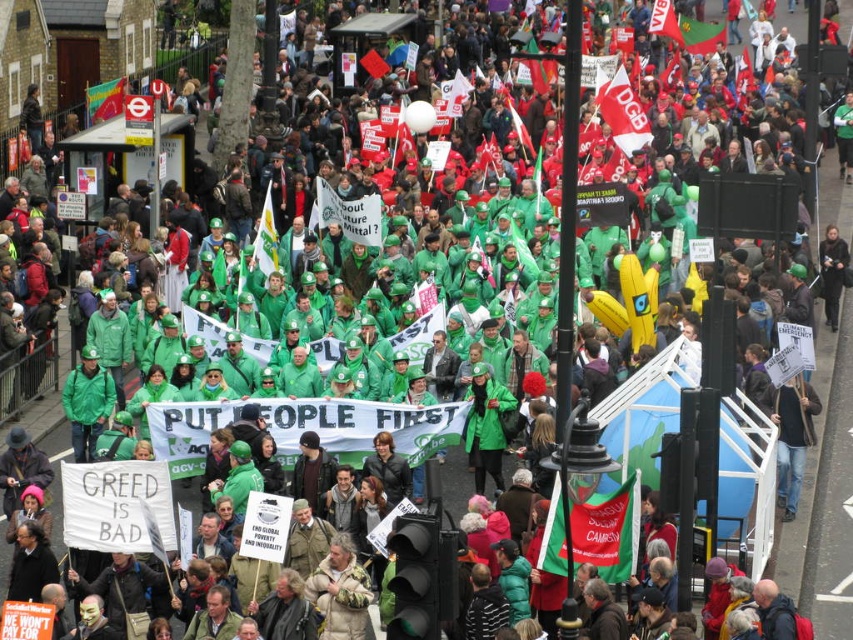
Question: Which of these objects is positioned closest to the green fabric flag at center?

Choices:
 (A) green fabric flag at upper center
 (B) red fabric flag at upper center

Answer: (B)

Question: Is red fabric flag at upper center positioned in front of green fabric flag at upper center?

Choices:
 (A) no
 (B) yes

Answer: (B)

Question: Does green fabric flag at center have a greater width compared to textured fabric flag at upper left?

Choices:
 (A) yes
 (B) no

Answer: (A)

Question: Which point is farther to the camera?

Choices:
 (A) green fabric flag at center
 (B) green fabric flag at upper center
 (C) textured fabric flag at upper left

Answer: (B)

Question: Is red fabric flag at upper center smaller than textured fabric flag at upper left?

Choices:
 (A) yes
 (B) no

Answer: (A)

Question: Which of the following is the closest to the observer?

Choices:
 (A) (628, 140)
 (B) (259, 262)

Answer: (B)